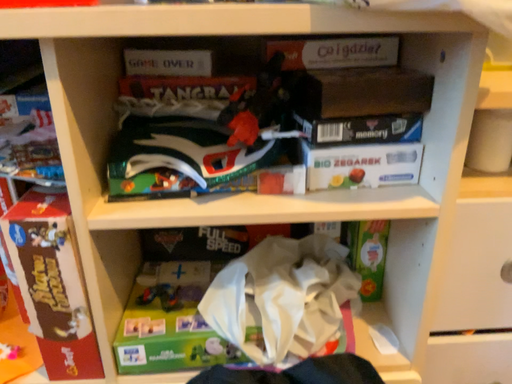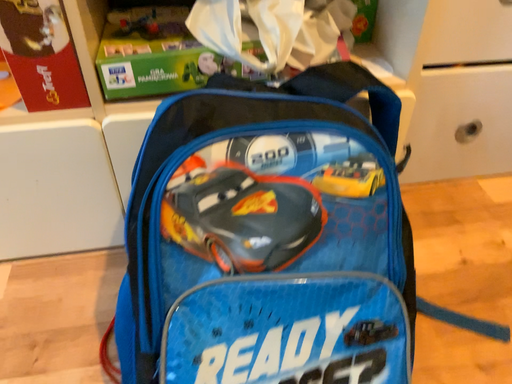
Question: Which way did the camera rotate in the video?

Choices:
 (A) rotated upward
 (B) rotated downward

Answer: (B)